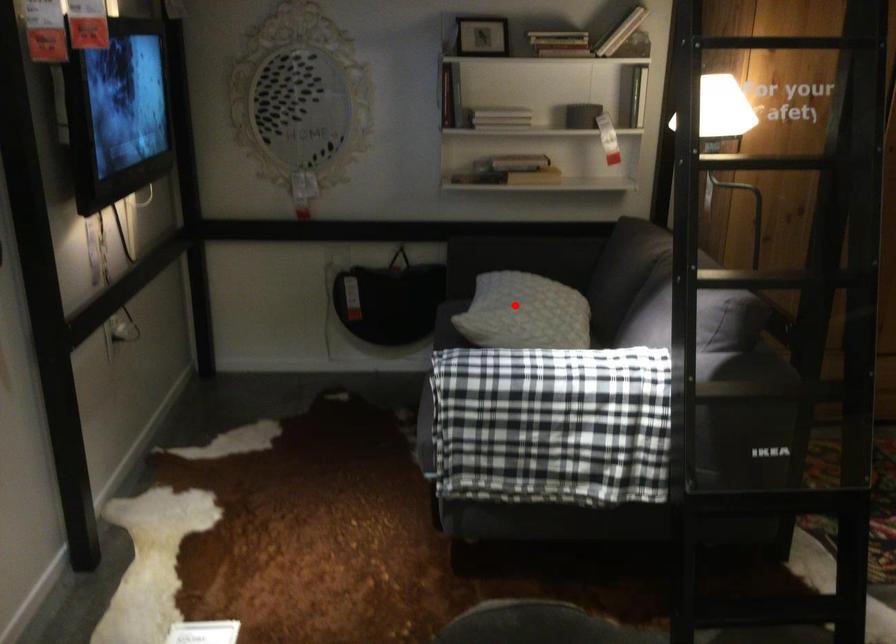
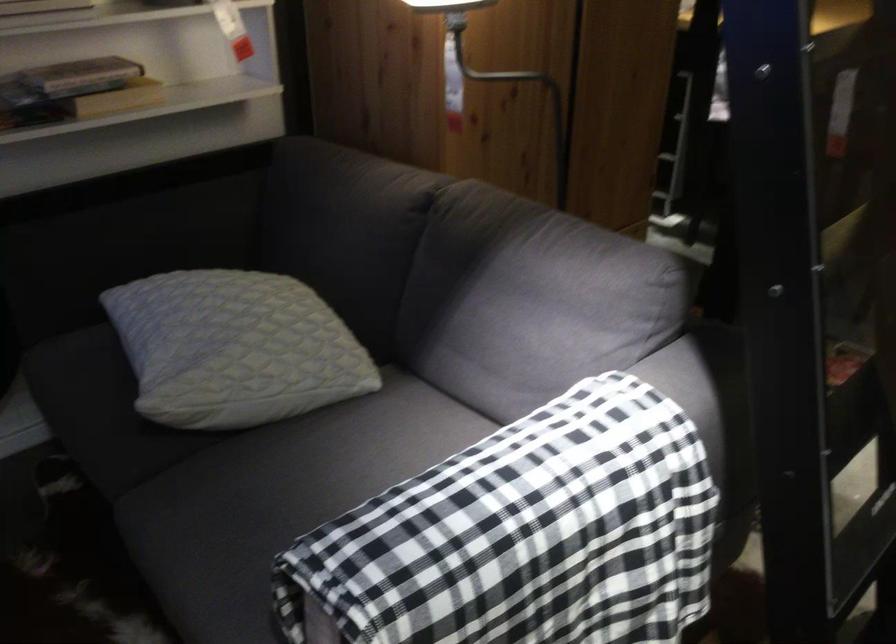
Where in the second image is the point corresponding to the highlighted location from the first image?

(234, 348)